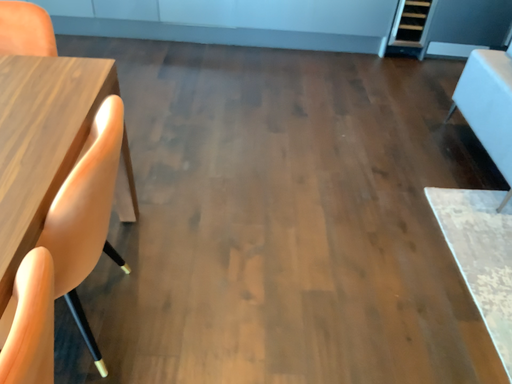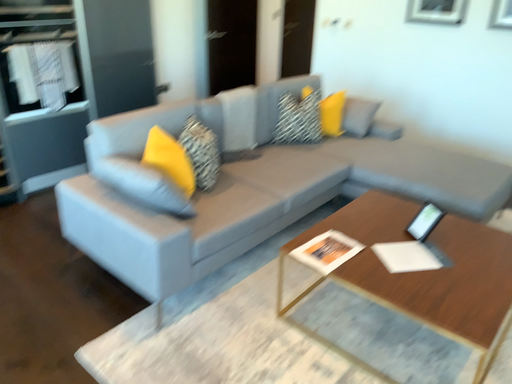
Question: How did the camera likely rotate when shooting the video?

Choices:
 (A) rotated downward
 (B) rotated upward

Answer: (B)